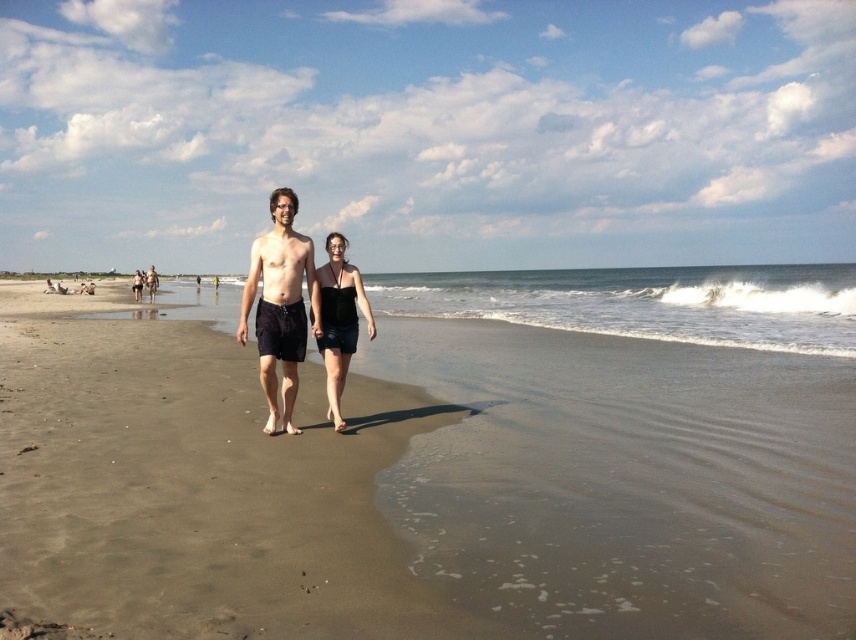
Question: Does smooth sand at center appear under black matte dress at center?

Choices:
 (A) yes
 (B) no

Answer: (A)

Question: Which object is closer to the camera taking this photo?

Choices:
 (A) dark blue shorts at center
 (B) matte black shorts at center
 (C) black matte dress at center
 (D) smooth sand at center

Answer: (D)

Question: Does dark blue shorts at center appear on the left side of black matte dress at center?

Choices:
 (A) no
 (B) yes

Answer: (B)

Question: Which point is closer to the camera taking this photo?

Choices:
 (A) (336, 332)
 (B) (152, 273)
 (C) (289, 390)

Answer: (C)

Question: Can you confirm if black matte dress at center is positioned above matte black shorts at center?

Choices:
 (A) no
 (B) yes

Answer: (A)

Question: Which point is farther from the camera taking this photo?

Choices:
 (A) (290, 280)
 (B) (147, 289)
 (C) (595, 339)

Answer: (B)